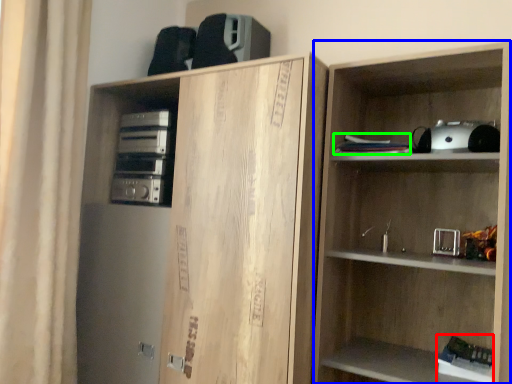
Question: Estimate the real-world distances between objects in this image. Which object is farther from book (highlighted by a red box), shelf (highlighted by a blue box) or book (highlighted by a green box)?

Choices:
 (A) shelf
 (B) book

Answer: (B)